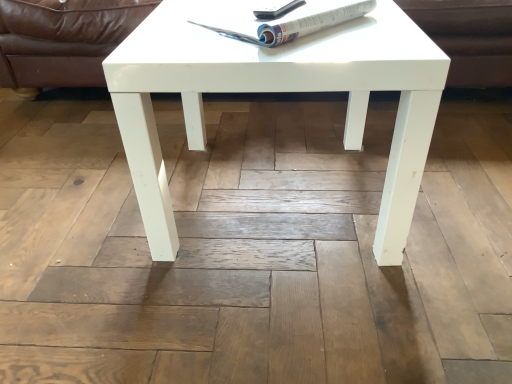
Question: In terms of size, does white glossy magazine at upper center appear bigger or smaller than brown leather couch at upper center?

Choices:
 (A) small
 (B) big

Answer: (A)

Question: Is white glossy magazine at upper center taller or shorter than brown leather couch at upper center?

Choices:
 (A) tall
 (B) short

Answer: (B)

Question: Estimate the real-world distances between objects in this image. Which object is closer to the white glossy magazine at upper center?

Choices:
 (A) brown leather couch at upper center
 (B) white glossy coffee table at center

Answer: (B)

Question: Considering the real-world distances, which object is closest to the brown leather couch at upper center?

Choices:
 (A) white glossy coffee table at center
 (B) white glossy magazine at upper center

Answer: (B)